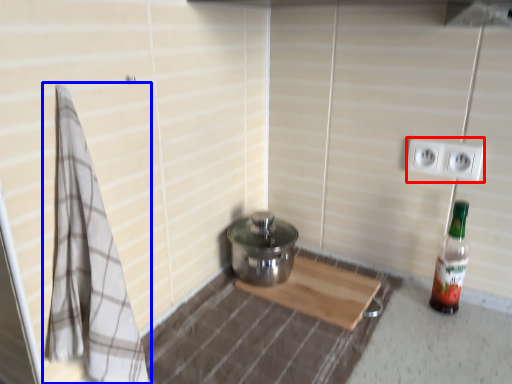
Question: Which object appears farthest to the camera in this image, electric outlet (highlighted by a red box) or bath towel (highlighted by a blue box)?

Choices:
 (A) electric outlet
 (B) bath towel

Answer: (A)